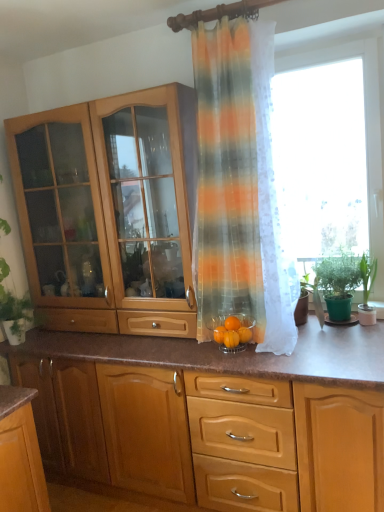
You are a GUI agent. You are given a task and a screenshot of the screen. Output one action in this format:
    pyautogui.click(x=<x>, y=<y>)
    Task: Click on the vacant space in front of translucent striped curtain at center
    The height and width of the screenshot is (512, 384).
    Given the screenshot: What is the action you would take?
    pyautogui.click(x=292, y=361)